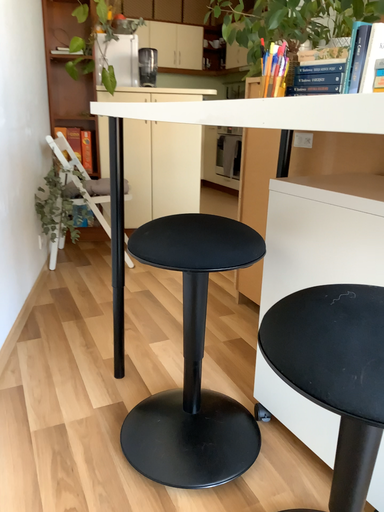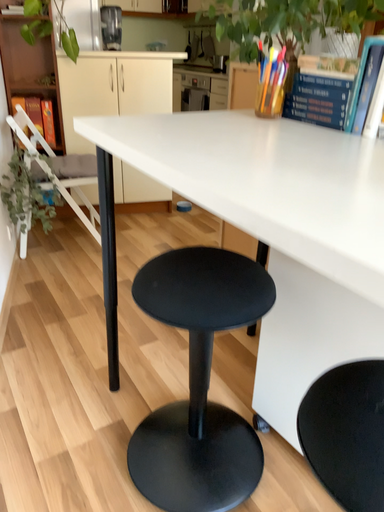
Question: How did the camera likely rotate when shooting the video?

Choices:
 (A) rotated upward
 (B) rotated downward

Answer: (B)